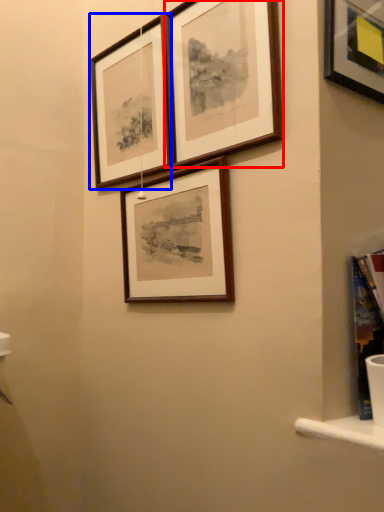
Question: Which object is closer to the camera taking this photo, picture frame (highlighted by a red box) or picture frame (highlighted by a blue box)?

Choices:
 (A) picture frame
 (B) picture frame

Answer: (A)